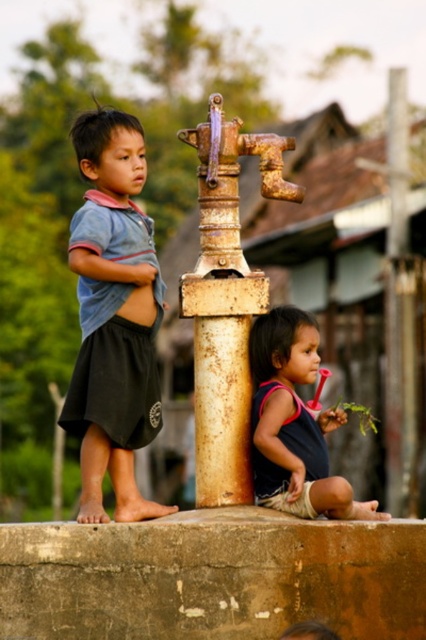
What are the coordinates of the rusty metal pole at center?

The coordinates of the rusty metal pole at center are at point (226, 301).

You are a photographer trying to capture a photo of the rusty metal pole at center while also including the blue cotton shirt at left in the frame. Based on their positions, can you position yourself so that both objects are visible in the same shot?

The blue cotton shirt at left is to the left of the rusty metal pole at center, so positioning yourself to the left of both objects would allow you to capture both in the same frame.

You are a photographer standing at the camera position. You want to capture a closeup shot of the blue cotton shirt at left. Given that your camera has a maximum zoom range of 100 feet, can you achieve this without moving closer?

The blue cotton shirt at left and camera are 175.47 feet apart from each other, which exceeds the camera maximum zoom range of 100 feet. Therefore, you cannot achieve the closeup shot without moving closer.